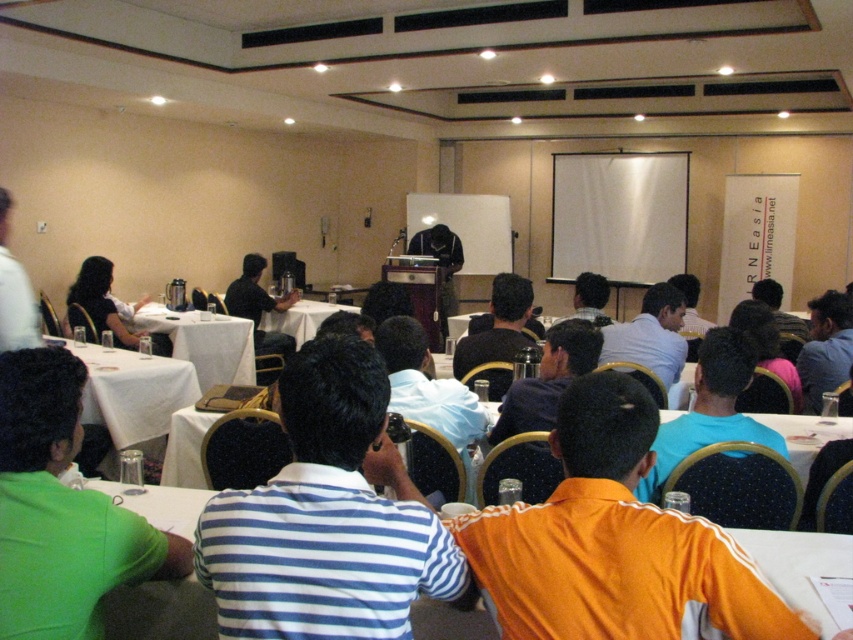
Question: Which object appears farthest from the camera in this image?

Choices:
 (A) white tablecloth at center
 (B) matte black laptop at center

Answer: (A)

Question: Does light blue shirt at center appear under blue striped shirt at upper right?

Choices:
 (A) no
 (B) yes

Answer: (A)

Question: Which point appears farthest from the camera in this image?

Choices:
 (A) (755, 426)
 (B) (219, 362)
 (C) (819, 387)

Answer: (B)

Question: Is light blue shirt at center above white shirt at upper left?

Choices:
 (A) no
 (B) yes

Answer: (A)

Question: Can you confirm if light blue shirt at center is thinner than blue striped shirt at upper right?

Choices:
 (A) yes
 (B) no

Answer: (B)

Question: Which of these objects is positioned closest to the green matte shirt at lower left?

Choices:
 (A) white cloth table at lower left
 (B) orange jersey at center
 (C) dark hair at upper left
 (D) blue fabric shirt at center

Answer: (B)